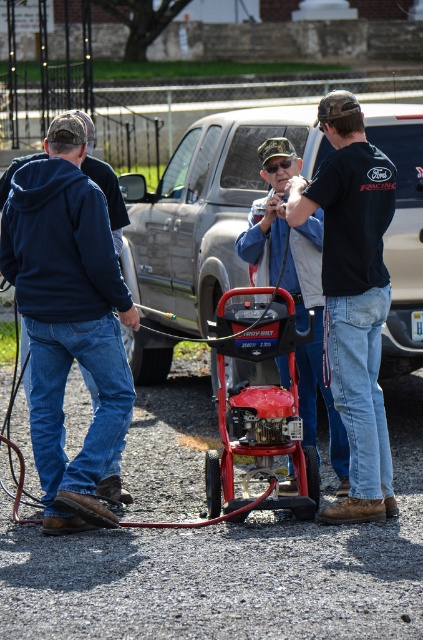
Can you confirm if dark blue hoodie at left is positioned above black cotton shirt at center?

No.

I want to click on dark blue hoodie at left, so click(x=68, y=320).

I want to click on dark blue hoodie at left, so click(68, 320).

Is black cotton shirt at center thinner than matte black jacket at center?

Correct, black cotton shirt at center's width is less than matte black jacket at center's.

Can you confirm if black cotton shirt at center is bigger than matte black jacket at center?

Yes.

Does point (353, 176) lie behind point (296, 234)?

No, it is not.

The image size is (423, 640). In order to click on black cotton shirt at center in this screenshot , I will do `click(354, 296)`.

Between dark blue hoodie at left and matte black jacket at center, which one has less height?

matte black jacket at center

Between point (49, 164) and point (313, 244), which one is positioned behind?

Positioned behind is point (313, 244).

Does point (98, 412) come in front of point (318, 268)?

Yes, point (98, 412) is closer to viewer.

You are a GUI agent. You are given a task and a screenshot of the screen. Output one action in this format:
    pyautogui.click(x=<x>, y=<y>)
    Task: Click on the dark blue hoodie at left
    The height and width of the screenshot is (640, 423).
    Given the screenshot: What is the action you would take?
    pyautogui.click(x=68, y=320)